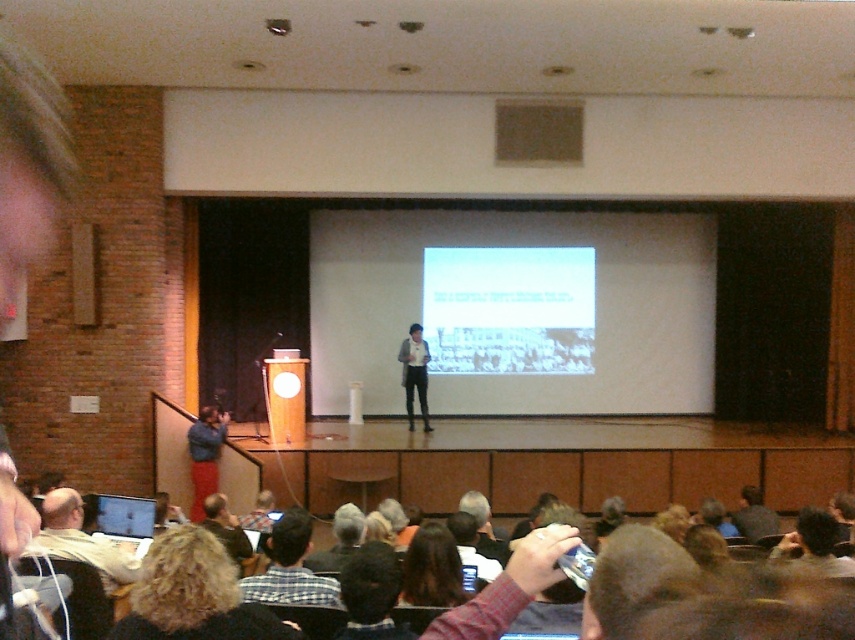
You are an attendee in the lecture hall and want to get a better view of the presentation. You notice two people in front of you with curly hair at lower left and dark brown hair at center. Which person should you ask to move so you can see the slide better?

The curly hair at lower left is taller than dark brown hair at center, so you should ask the person with curly hair at lower left to move as they are blocking your view more due to their height.

In the lecture hall scene, you notice two people sitting in the front row on the left side. One has curly hair at lower left and the other is wearing a light gray fabric shirt at lower left. From the perspective of someone sitting at the back of the lecture hall, which of these two people is sitting more to the left?

The light gray fabric shirt at lower left is sitting more to the left because the curly hair at lower left is to the right of it.